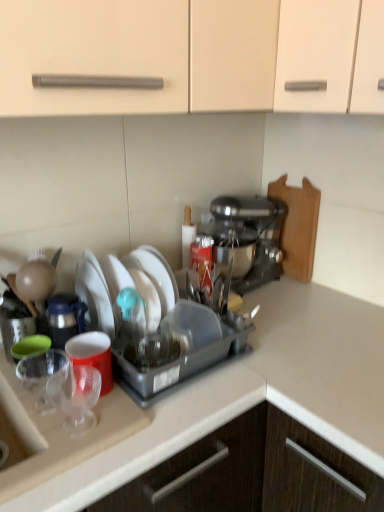
What is the approximate height of white matte plate at center, the second tableware when ordered from front to back?

The height of white matte plate at center, the second tableware when ordered from front to back, is 7.87 inches.

Find the location of a particular element. The image size is (384, 512). matte plastic cup at left is located at coordinates (92, 355).

Is transparent plastic cups at left inside the boundaries of matte plastic cup at left, or outside?

transparent plastic cups at left is located beyond the bounds of matte plastic cup at left.

From the image's perspective, is transparent plastic cups at left above or below matte plastic cup at left?

transparent plastic cups at left is below matte plastic cup at left.

In terms of height, does transparent plastic cups at left look taller or shorter compared to matte plastic cup at left?

Clearly, transparent plastic cups at left is taller compared to matte plastic cup at left.

Which is in front, transparent plastic cups at left or matte plastic cup at left?

transparent plastic cups at left is closer to the camera.

Which object is thinner, white matte plate at center, arranged as the 2th tableware when ordered from the bottom, or transparent plastic cup at lower left, the 1th tableware from the bottom?

Thinner between the two is transparent plastic cup at lower left, the 1th tableware from the bottom.

Between white matte plate at center, arranged as the 2th tableware when ordered from the bottom, and transparent plastic cup at lower left, which is the second tableware in back-to-front order, which one has larger size?

white matte plate at center, arranged as the 2th tableware when ordered from the bottom.

Relative to transparent plastic cup at lower left, which ranks as the 1th tableware in front-to-back order, is white matte plate at center, the 1th tableware in the top-to-bottom sequence, in front or behind?

Clearly, white matte plate at center, the 1th tableware in the top-to-bottom sequence, is behind transparent plastic cup at lower left, which ranks as the 1th tableware in front-to-back order.

Are white matte plate at center, positioned as the 1th tableware in back-to-front order, and transparent plastic cup at lower left, the 1th tableware from the bottom, making contact?

white matte plate at center, positioned as the 1th tableware in back-to-front order, and transparent plastic cup at lower left, the 1th tableware from the bottom, are clearly separated.

From the image's perspective, is white matte plate at center, the second tableware when ordered from front to back, positioned above or below transparent plastic cups at left?

white matte plate at center, the second tableware when ordered from front to back, is above transparent plastic cups at left.

Is white matte plate at center, the 1th tableware in the top-to-bottom sequence, completely or partially outside of transparent plastic cups at left?

Yes, white matte plate at center, the 1th tableware in the top-to-bottom sequence, is not within transparent plastic cups at left.

Considering the relative sizes of white matte plate at center, arranged as the 2th tableware when ordered from the bottom, and transparent plastic cups at left in the image provided, is white matte plate at center, arranged as the 2th tableware when ordered from the bottom, smaller than transparent plastic cups at left?

Indeed, white matte plate at center, arranged as the 2th tableware when ordered from the bottom, has a smaller size compared to transparent plastic cups at left.

Which object is wider, transparent plastic cup at lower left, which ranks as the 1th tableware in front-to-back order, or wooden cutting board at right?

transparent plastic cup at lower left, which ranks as the 1th tableware in front-to-back order.

Which object is more forward, transparent plastic cup at lower left, which ranks as the 1th tableware in front-to-back order, or wooden cutting board at right?

transparent plastic cup at lower left, which ranks as the 1th tableware in front-to-back order, is closer to the camera.

Which of these two, transparent plastic cup at lower left, which is the second tableware in back-to-front order, or wooden cutting board at right, is bigger?

wooden cutting board at right.

From the image's perspective, is transparent plastic cup at lower left, the 1th tableware from the bottom, located above or below transparent plastic cups at left?

transparent plastic cup at lower left, the 1th tableware from the bottom, is above transparent plastic cups at left.

Between transparent plastic cup at lower left, the 1th tableware from the bottom, and transparent plastic cups at left, which one has less height?

With less height is transparent plastic cup at lower left, the 1th tableware from the bottom.

Which is more to the left, transparent plastic cup at lower left, the 1th tableware from the bottom, or transparent plastic cups at left?

Positioned to the left is transparent plastic cups at left.

Considering the relative positions of transparent plastic cup at lower left, which ranks as the 1th tableware in front-to-back order, and metallic silver stand mixer at center-right in the image provided, is transparent plastic cup at lower left, which ranks as the 1th tableware in front-to-back order, to the left of metallic silver stand mixer at center-right from the viewer's perspective?

Correct, you'll find transparent plastic cup at lower left, which ranks as the 1th tableware in front-to-back order, to the left of metallic silver stand mixer at center-right.

From their relative heights in the image, would you say transparent plastic cup at lower left, the 1th tableware from the bottom, is taller or shorter than metallic silver stand mixer at center-right?

Considering their sizes, transparent plastic cup at lower left, the 1th tableware from the bottom, has less height than metallic silver stand mixer at center-right.

Does point (100, 375) come in front of point (221, 243)?

That is True.

Between transparent plastic cup at lower left, which is the second tableware in back-to-front order, and metallic silver stand mixer at center-right, which one has larger size?

With larger size is metallic silver stand mixer at center-right.

From a real-world perspective, between transparent plastic cups at left and metallic silver stand mixer at center-right, who is vertically lower?

In real-world perspective, transparent plastic cups at left is lower.

Is transparent plastic cups at left outside of metallic silver stand mixer at center-right?

Yes, transparent plastic cups at left is located beyond the bounds of metallic silver stand mixer at center-right.

The image size is (384, 512). Find the location of `coffee maker above the transparent plastic cups at left (from a real-world perspective)`. coffee maker above the transparent plastic cups at left (from a real-world perspective) is located at coordinates (247, 238).

Identify the location of sink below the matte plastic cup at left (from a real-world perspective). (54, 434).

Where is `tableware above the transparent plastic cup at lower left, which is the second tableware in back-to-front order (from the image's perspective)`? The image size is (384, 512). tableware above the transparent plastic cup at lower left, which is the second tableware in back-to-front order (from the image's perspective) is located at coordinates (126, 286).

From the picture: Estimate the real-world distances between objects in this image. Which object is further from metallic silver stand mixer at center-right, matte plastic cup at left or transparent plastic cups at left?

Among the two, transparent plastic cups at left is located further to metallic silver stand mixer at center-right.

Estimate the real-world distances between objects in this image. Which object is further from transparent plastic cup at lower left, the 1th tableware from the bottom, white matte plate at center, the 1th tableware in the top-to-bottom sequence, or matte plastic cup at left?

Based on the image, white matte plate at center, the 1th tableware in the top-to-bottom sequence, appears to be further to transparent plastic cup at lower left, the 1th tableware from the bottom.

Based on their spatial positions, is matte plastic cup at left or metallic silver stand mixer at center-right further from transparent plastic cup at lower left, which is the second tableware in back-to-front order?

metallic silver stand mixer at center-right is further to transparent plastic cup at lower left, which is the second tableware in back-to-front order.

From the image, which object appears to be nearer to metallic silver stand mixer at center-right, wooden cutting board at right or transparent plastic cup at lower left, which is the second tableware in back-to-front order?

wooden cutting board at right is closer to metallic silver stand mixer at center-right.

When comparing their distances from wooden cutting board at right, does transparent plastic cup at lower left, which is the second tableware in back-to-front order, or metallic silver stand mixer at center-right seem closer?

metallic silver stand mixer at center-right is closer to wooden cutting board at right.

When comparing their distances from white matte plate at center, arranged as the 2th tableware when ordered from the bottom, does transparent plastic cups at left or matte plastic cup at left seem further?

transparent plastic cups at left.

From the image, which object appears to be nearer to wooden cutting board at right, transparent plastic cups at left or white matte plate at center, positioned as the 1th tableware in back-to-front order?

Among the two, white matte plate at center, positioned as the 1th tableware in back-to-front order, is located nearer to wooden cutting board at right.

From the image, which object appears to be nearer to white matte plate at center, the 1th tableware in the top-to-bottom sequence, matte plastic cup at left or metallic silver stand mixer at center-right?

matte plastic cup at left lies closer to white matte plate at center, the 1th tableware in the top-to-bottom sequence, than the other object.

The height and width of the screenshot is (512, 384). What are the coordinates of `coffee cup between transparent plastic cups at left and wooden cutting board at right along the z-axis` in the screenshot? It's located at (92, 355).

Identify the location of coffee cup between transparent plastic cups at left and white matte plate at center, arranged as the 2th tableware when ordered from the bottom, along the z-axis. (92, 355).

This screenshot has height=512, width=384. I want to click on tableware positioned between transparent plastic cup at lower left, which ranks as the 1th tableware in front-to-back order, and metallic silver stand mixer at center-right from near to far, so click(x=126, y=286).

Where is `coffee cup positioned between transparent plastic cups at left and metallic silver stand mixer at center-right from near to far`? The image size is (384, 512). coffee cup positioned between transparent plastic cups at left and metallic silver stand mixer at center-right from near to far is located at coordinates (92, 355).